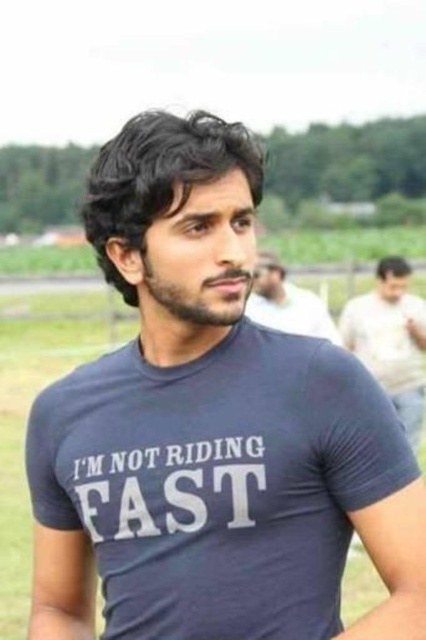
Question: Can you confirm if light beige shirt at right is positioned to the left of matte blue t-shirt at center?

Choices:
 (A) yes
 (B) no

Answer: (B)

Question: Which of the following is the farthest from the observer?

Choices:
 (A) (406, 300)
 (B) (310, 316)

Answer: (A)

Question: Among these points, which one is farthest from the camera?

Choices:
 (A) (267, 276)
 (B) (374, 330)

Answer: (A)

Question: From the image, what is the correct spatial relationship of light beige shirt at right in relation to matte blue t-shirt at center?

Choices:
 (A) left
 (B) right

Answer: (B)

Question: Observing the image, what is the correct spatial positioning of light beige shirt at right in reference to matte blue t-shirt at center?

Choices:
 (A) left
 (B) right

Answer: (B)

Question: Which point is closer to the camera?

Choices:
 (A) (291, 317)
 (B) (393, 307)

Answer: (A)